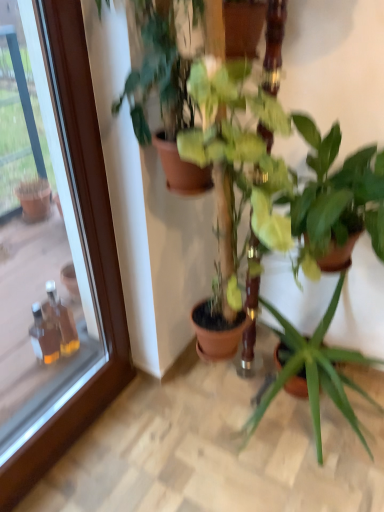
Question: Is green glossy plant at center, positioned as the second houseplant in right-to-left order, at the left side of green matte plant at center, the 1th houseplant positioned from the right?

Choices:
 (A) yes
 (B) no

Answer: (A)

Question: Is green glossy plant at center, positioned as the second houseplant in right-to-left order, facing away from green matte plant at center, acting as the 4th houseplant starting from the left?

Choices:
 (A) no
 (B) yes

Answer: (A)

Question: From a real-world perspective, is green glossy plant at center, positioned as the second houseplant in right-to-left order, over green matte plant at center, acting as the 4th houseplant starting from the left?

Choices:
 (A) yes
 (B) no

Answer: (A)

Question: Does green glossy plant at center, which is counted as the third houseplant, starting from the left, have a lesser width compared to green matte plant at center, the 1th houseplant positioned from the right?

Choices:
 (A) no
 (B) yes

Answer: (B)

Question: Are green glossy plant at center, which is counted as the third houseplant, starting from the left, and green matte plant at center, the 1th houseplant positioned from the right, far apart?

Choices:
 (A) no
 (B) yes

Answer: (A)

Question: Considering the positions of point (223, 84) and point (160, 140), is point (223, 84) closer or farther from the camera than point (160, 140)?

Choices:
 (A) closer
 (B) farther

Answer: (A)

Question: Considering their positions, is green glossy plant at center, the 2th houseplant when ordered from left to right, located in front of or behind green matte plant at center, acting as the 4th houseplant starting from the right?

Choices:
 (A) behind
 (B) front

Answer: (B)

Question: Considering the positions of green glossy plant at center, the 2th houseplant when ordered from left to right, and green matte plant at center, acting as the 4th houseplant starting from the right, in the image, is green glossy plant at center, the 2th houseplant when ordered from left to right, bigger or smaller than green matte plant at center, acting as the 4th houseplant starting from the right,?

Choices:
 (A) big
 (B) small

Answer: (A)

Question: From their relative heights in the image, would you say green glossy plant at center, which appears as the 3th houseplant when viewed from the right, is taller or shorter than green matte plant at center, which ranks as the 1th houseplant in left-to-right order?

Choices:
 (A) short
 (B) tall

Answer: (B)

Question: In the image, is green matte plant at center, acting as the 4th houseplant starting from the right, positioned in front of or behind green glossy plant at center, which appears as the 3th houseplant when viewed from the right?

Choices:
 (A) behind
 (B) front

Answer: (A)

Question: From a real-world perspective, is green matte plant at center, acting as the 4th houseplant starting from the right, above or below green glossy plant at center, the 2th houseplant when ordered from left to right?

Choices:
 (A) above
 (B) below

Answer: (A)

Question: Looking at the image, does green matte plant at center, acting as the 4th houseplant starting from the right, seem bigger or smaller compared to green glossy plant at center, the 2th houseplant when ordered from left to right?

Choices:
 (A) big
 (B) small

Answer: (B)

Question: Which is correct: green matte plant at center, acting as the 4th houseplant starting from the right, is inside green glossy plant at center, the 2th houseplant when ordered from left to right, or outside of it?

Choices:
 (A) inside
 (B) outside

Answer: (B)

Question: In terms of size, does green matte plant at center, the 1th houseplant positioned from the right, appear bigger or smaller than green matte plant at center, which ranks as the 1th houseplant in left-to-right order?

Choices:
 (A) big
 (B) small

Answer: (A)

Question: Would you say green matte plant at center, the 1th houseplant positioned from the right, is to the left or to the right of green matte plant at center, which ranks as the 1th houseplant in left-to-right order, in the picture?

Choices:
 (A) left
 (B) right

Answer: (B)